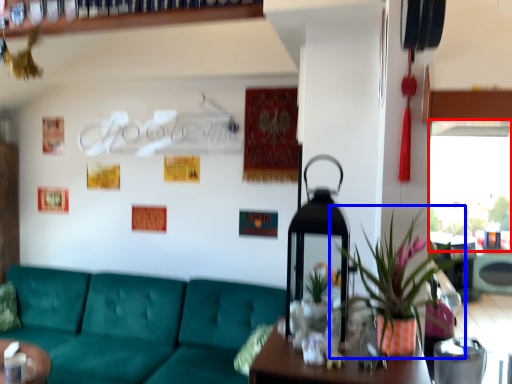
Question: Which object is closer to the camera taking this photo, window screen (highlighted by a red box) or houseplant (highlighted by a blue box)?

Choices:
 (A) window screen
 (B) houseplant

Answer: (B)